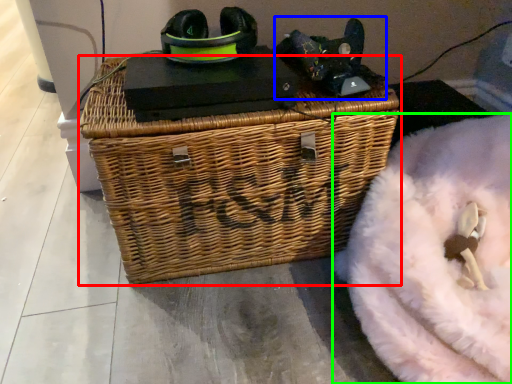
Question: Which is nearer to the picnic basket (highlighted by a red box)? bean bag chair (highlighted by a blue box) or bean bag chair (highlighted by a green box).

Choices:
 (A) bean bag chair
 (B) bean bag chair

Answer: (A)